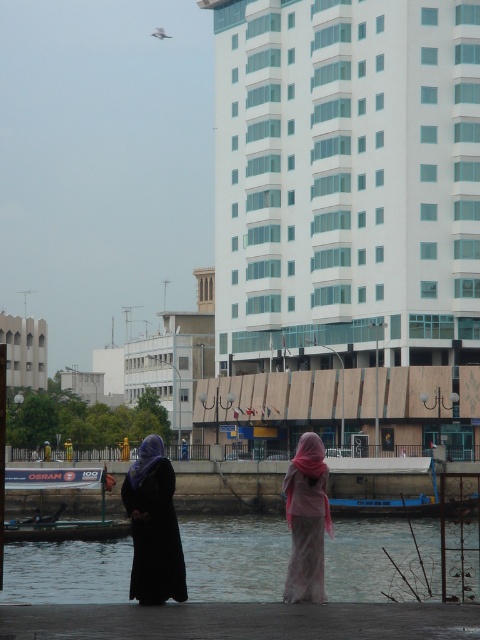
Does white glass building at upper center appear over dark gray concrete dock at lower center?

Yes, white glass building at upper center is above dark gray concrete dock at lower center.

Is white glass building at upper center behind dark gray concrete dock at lower center?

Yes.

Where is `white glass building at upper center`? white glass building at upper center is located at coordinates (347, 220).

The width and height of the screenshot is (480, 640). In order to click on white glass building at upper center in this screenshot , I will do `click(347, 220)`.

Find the location of `white glass building at upper center`. white glass building at upper center is located at coordinates (347, 220).

Does point (443, 230) lie behind point (38, 342)?

That is False.

Who is positioned more to the left, white glass building at upper center or white stone building at left?

Positioned to the left is white stone building at left.

Describe the element at coordinates (347, 220) in the screenshot. I see `white glass building at upper center` at that location.

Locate an element on the screen. The width and height of the screenshot is (480, 640). white glass building at upper center is located at coordinates coord(347,220).